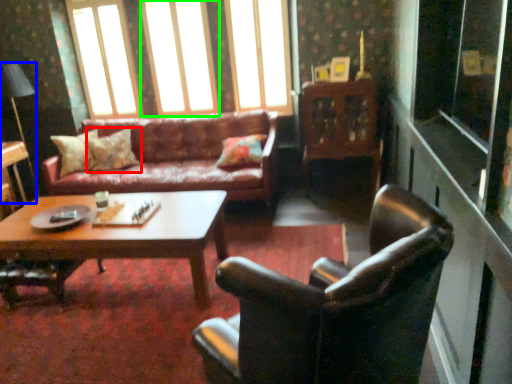
Question: Which object is positioned closest to pillow (highlighted by a red box)? Select from lamp (highlighted by a blue box) and window (highlighted by a green box).

Choices:
 (A) lamp
 (B) window

Answer: (B)